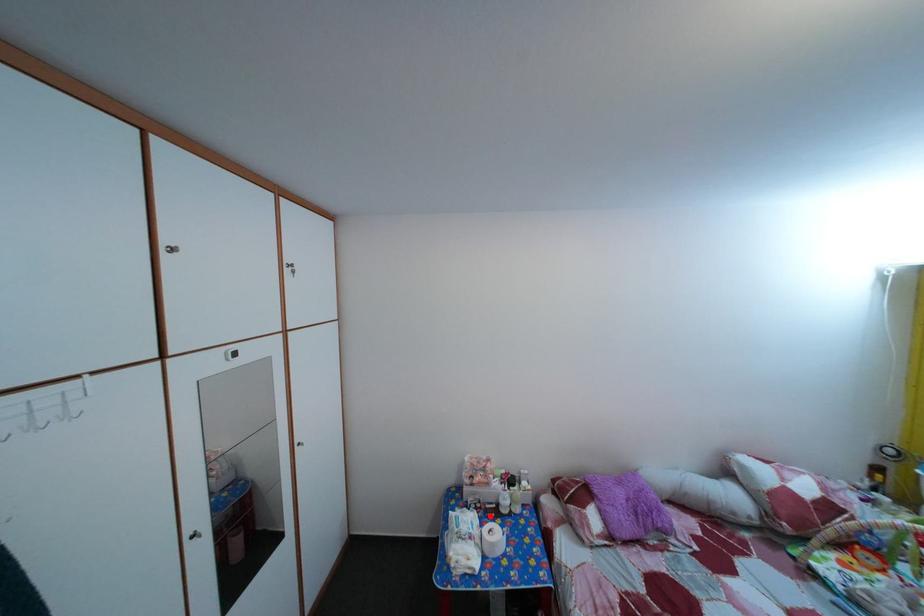
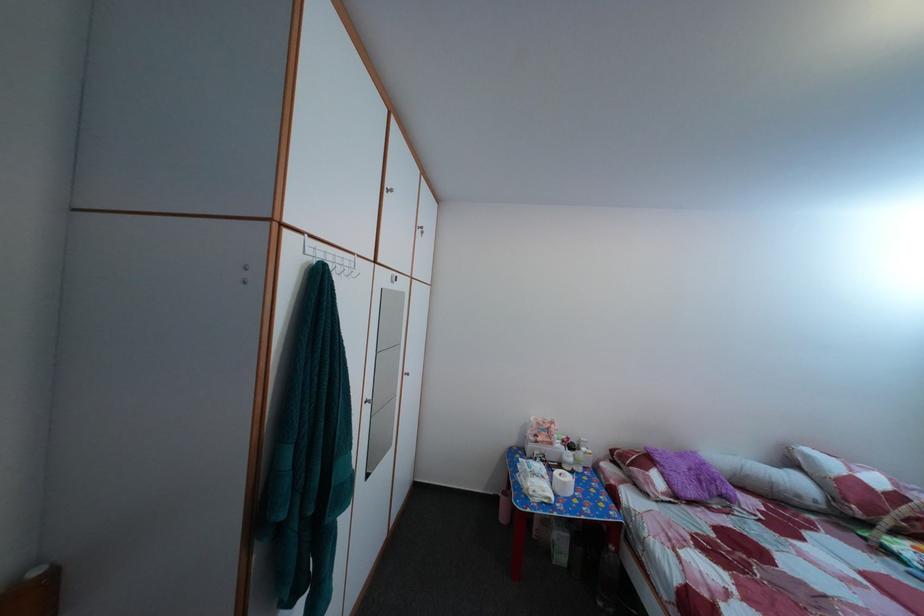
In the second image, find the point that corresponds to the highlighted location in the first image.

(555, 469)